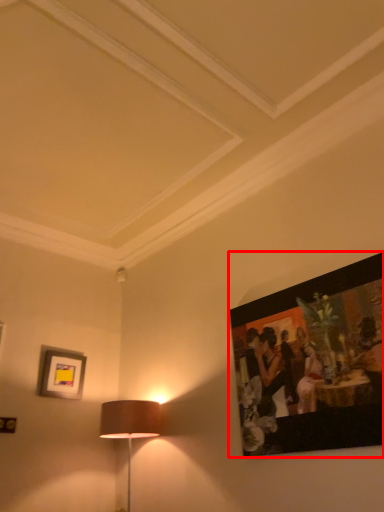
Question: From the image's perspective, what is the correct spatial positioning of picture frame (annotated by the red box) in reference to picture frame?

Choices:
 (A) below
 (B) above

Answer: (B)